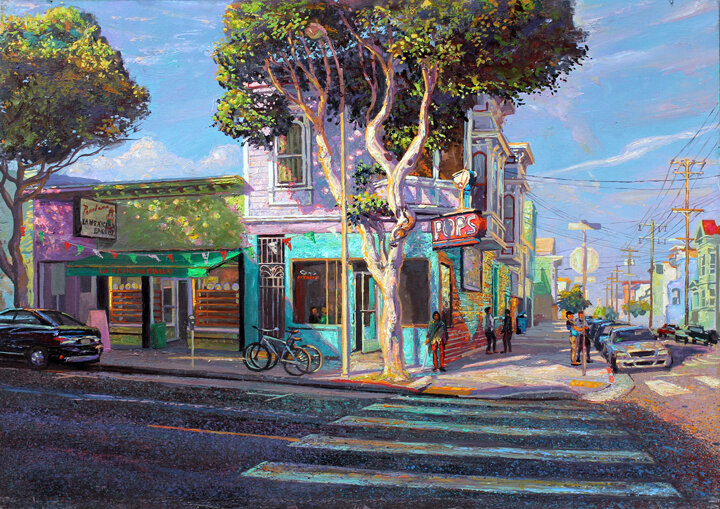
At what (x,y) coordinates should I click in order to perform the action: click on door. Please return your answer as a coordinate pair (x, y). Looking at the image, I should click on tap(181, 308), tap(368, 316).